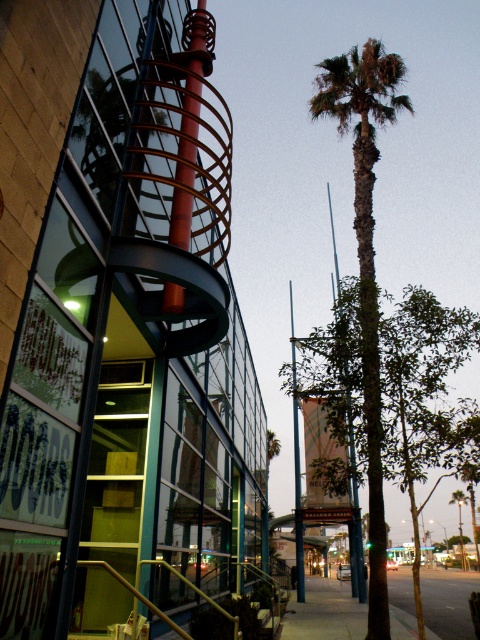
Question: Is green leafy tree at center smaller than green leafy palm tree at center?

Choices:
 (A) no
 (B) yes

Answer: (B)

Question: Among these points, which one is farthest from the camera?

Choices:
 (A) [447, 429]
 (B) [408, 621]
 (C) [380, 531]

Answer: (B)

Question: Where is green leafy tree at center located in relation to gray concrete sidewalk at lower center in the image?

Choices:
 (A) below
 (B) above

Answer: (B)

Question: Can you confirm if green leafy palm tree at center is thinner than gray concrete sidewalk at lower center?

Choices:
 (A) no
 (B) yes

Answer: (B)

Question: Which object is positioned closest to the green leafy tree at center?

Choices:
 (A) gray concrete sidewalk at lower center
 (B) green leafy palm tree at center

Answer: (B)

Question: Which is nearer to the green leafy palm tree at center?

Choices:
 (A) gray concrete sidewalk at lower center
 (B) green leafy tree at center

Answer: (B)